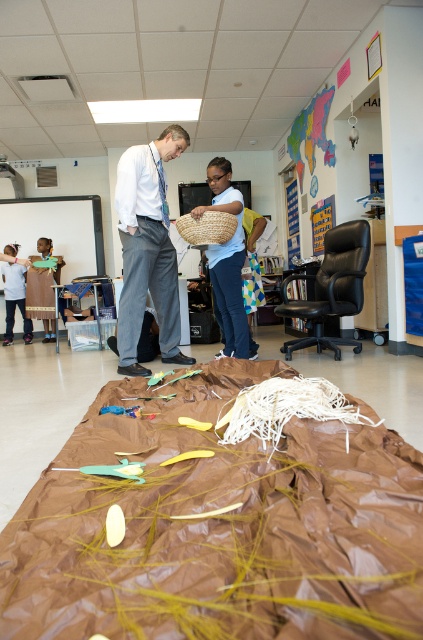
Question: Does white cotton pants at center appear on the right side of woven straw basket at center?

Choices:
 (A) no
 (B) yes

Answer: (A)

Question: Does brown paper bag at center appear over brown fabric dress at lower left?

Choices:
 (A) no
 (B) yes

Answer: (A)

Question: Which point is farther to the camera?

Choices:
 (A) matte blue shirt at left
 (B) brown paper bag at center
 (C) brown fabric dress at lower left

Answer: (A)

Question: Which point is closer to the camera?

Choices:
 (A) natural woven basket at center
 (B) brown fabric dress at lower left

Answer: (A)

Question: In this image, where is brown fabric dress at lower left located relative to matte blue shirt at left?

Choices:
 (A) left
 (B) right

Answer: (B)

Question: Among these objects, which one is farthest from the camera?

Choices:
 (A) woven straw basket at center
 (B) brown paper bag at center
 (C) natural woven basket at center

Answer: (C)